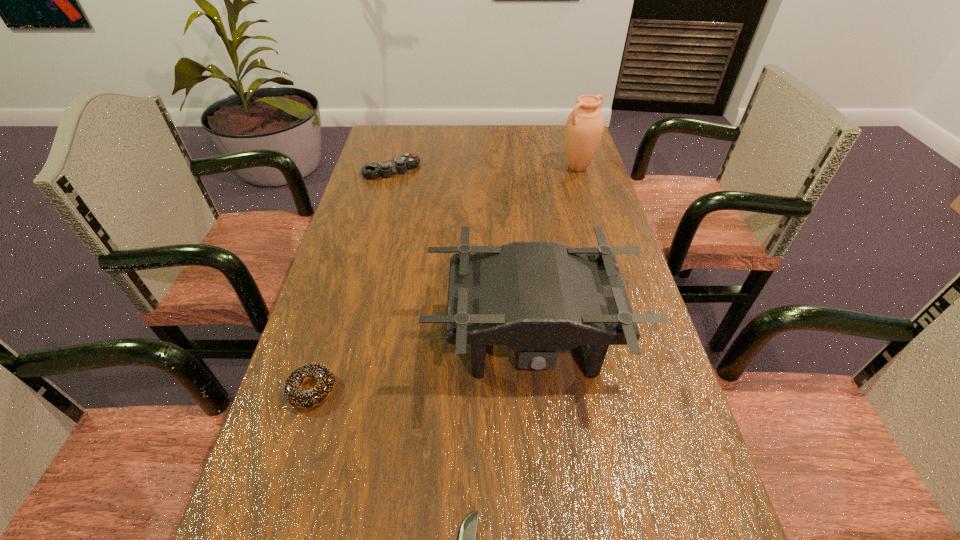
Image resolution: width=960 pixels, height=540 pixels. Find the location of `urn`. urn is located at coordinates (584, 127).

Find the location of `the second tallest object`. the second tallest object is located at coordinates (537, 297).

Find the location of `the third tallest object`. the third tallest object is located at coordinates (399, 165).

This screenshot has width=960, height=540. I want to click on the fourth tallest object, so click(x=293, y=393).

Locate an element on the screen. The height and width of the screenshot is (540, 960). vacant position located on the left of the urn is located at coordinates (478, 167).

The image size is (960, 540). I want to click on vacant point located with a camera mounted on the underside of the second tallest object, so click(551, 534).

You are a GUI agent. You are given a task and a screenshot of the screen. Output one action in this format:
    pyautogui.click(x=<x>, y=<y>)
    Task: Click on the vacant point located on the right of the control
    
    Given the screenshot: What is the action you would take?
    pyautogui.click(x=468, y=170)

Locate an element on the screen. The height and width of the screenshot is (540, 960). vacant space located 0.300m on the right of the fourth tallest object is located at coordinates (489, 390).

I want to click on object present at the far edge, so click(584, 127).

Locate an element on the screen. control at the left edge is located at coordinates (399, 165).